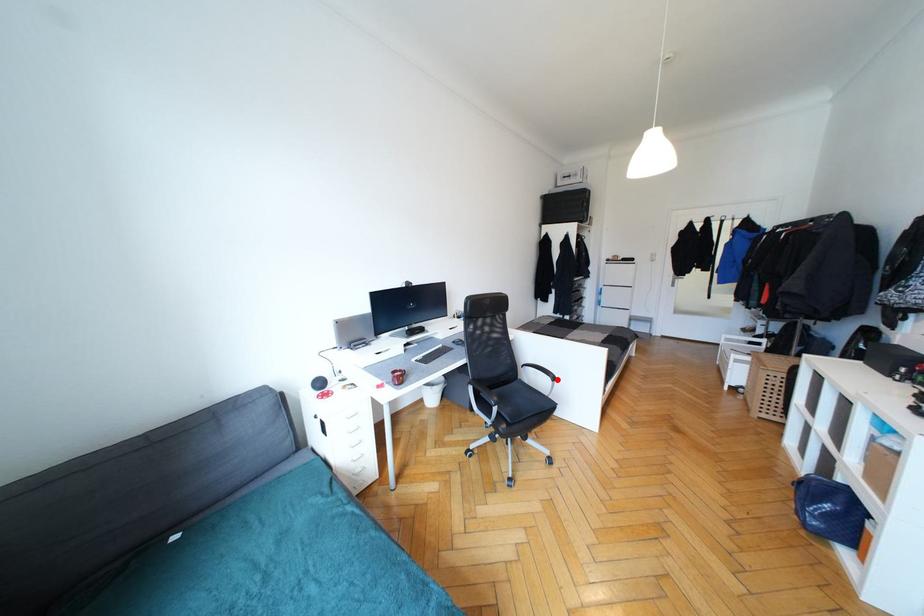
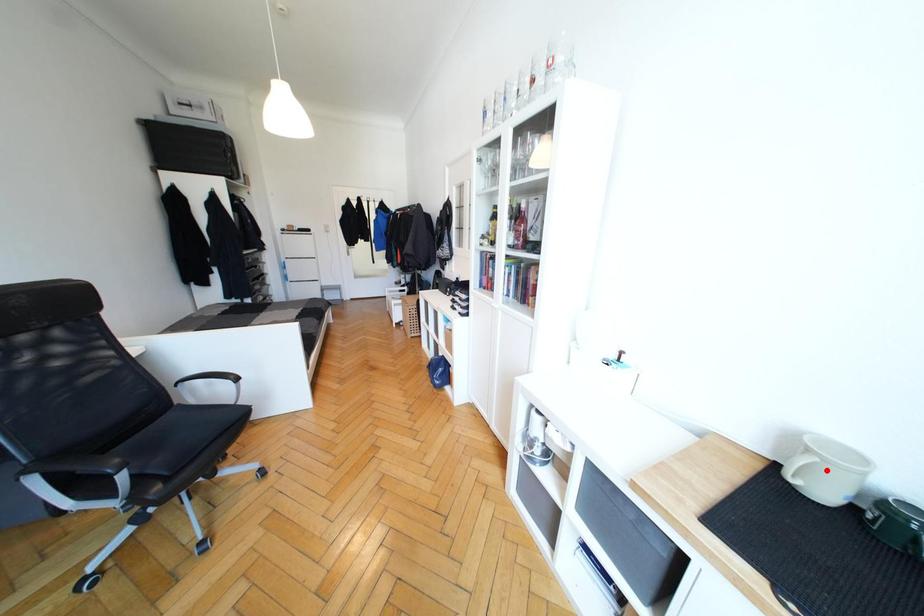
I am providing you with two images of the same scene from different viewpoints. A red point is marked on the first image and another point is marked on the second image. Are the points marked in image1 and image2 representing the same 3D position?

No